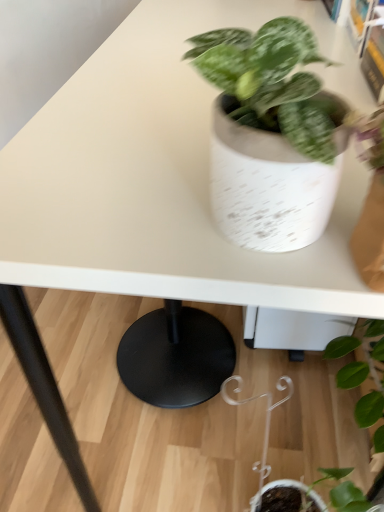
Locate an element on the screen. Image resolution: width=384 pixels, height=512 pixels. green matte plant at lower right is located at coordinates (362, 370).

What do you see at coordinates (362, 370) in the screenshot?
I see `green matte plant at lower right` at bounding box center [362, 370].

Image resolution: width=384 pixels, height=512 pixels. I want to click on green matte plant at lower right, so click(362, 370).